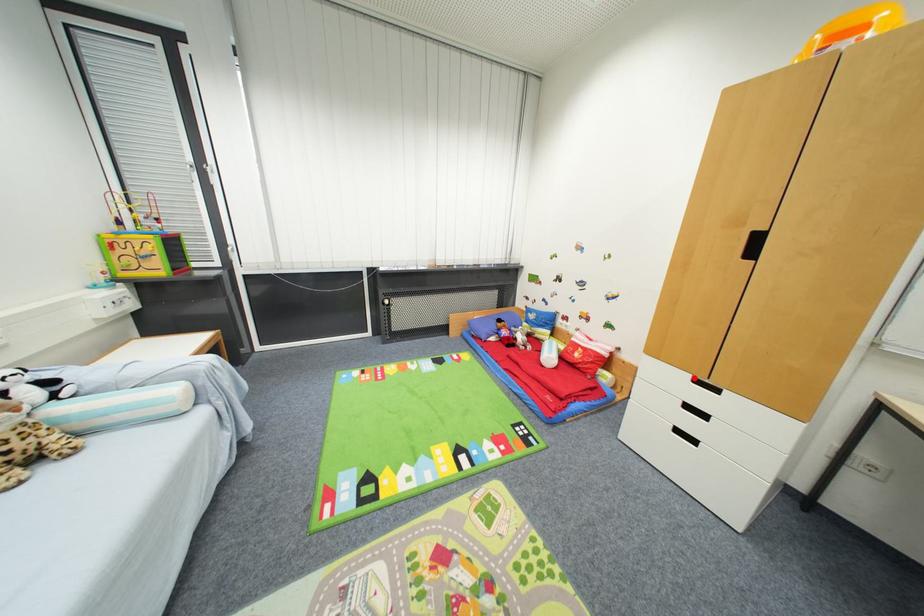
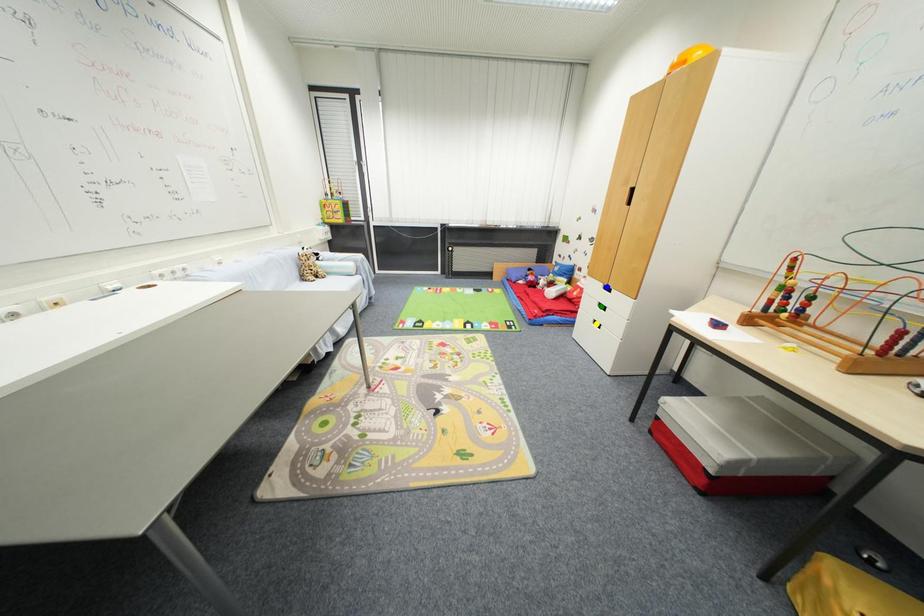
Question: I am providing you with two images of the same scene from different viewpoints. A red point is marked on the first image. You are given multiple points on the second image. Which spot in image 2 lines up with the point in image 1?

Choices:
 (A) green point
 (B) blue point
 (C) yellow point

Answer: (B)